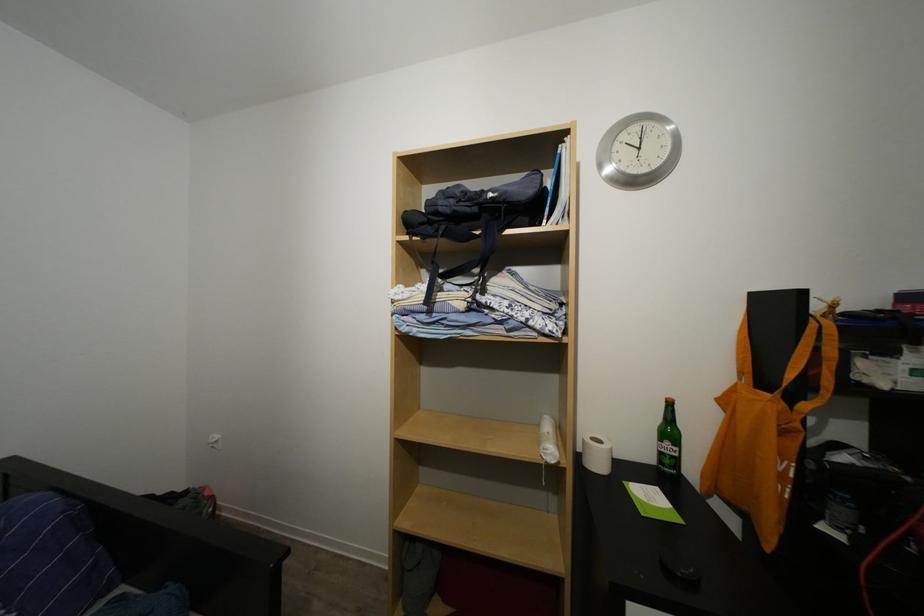
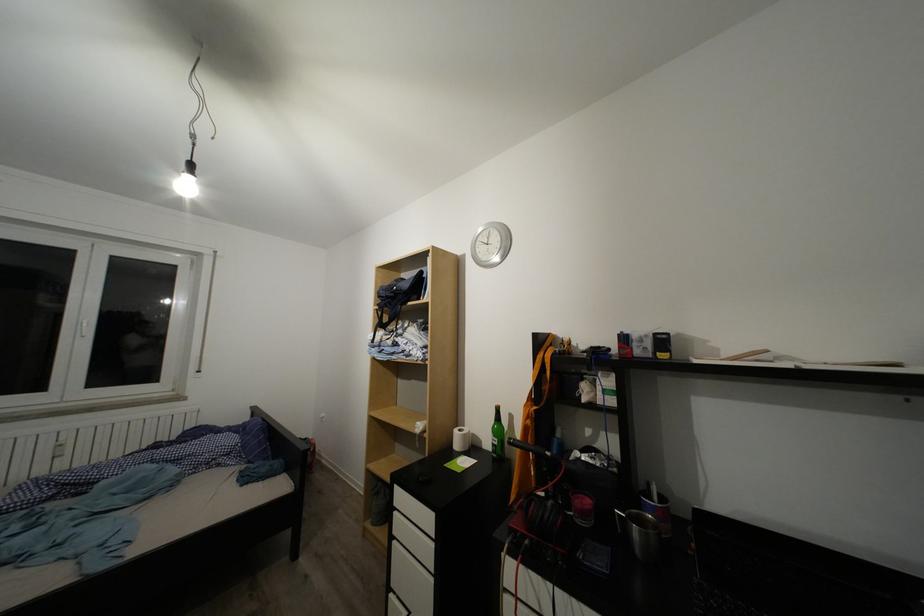
In the second image, find the point that corresponds to the point at 601,446 in the first image.

(468, 436)